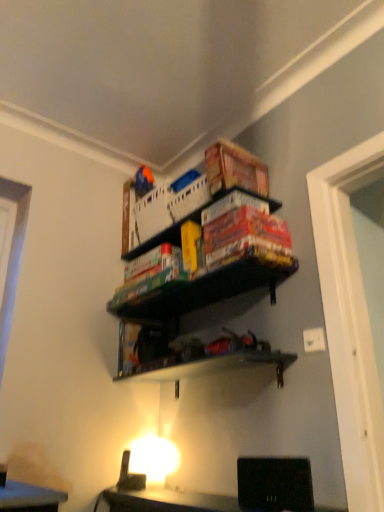
What do you see at coordinates (167, 207) in the screenshot? I see `white plastic crate at upper center` at bounding box center [167, 207].

Locate an element on the screen. white plastic crate at upper center is located at coordinates (167, 207).

What do you see at coordinates (205, 289) in the screenshot? I see `green matte board game at center` at bounding box center [205, 289].

The image size is (384, 512). Find the location of `green matte board game at center`. green matte board game at center is located at coordinates (205, 289).

Where is `white plastic crate at upper center`? Image resolution: width=384 pixels, height=512 pixels. white plastic crate at upper center is located at coordinates (167, 207).

Which object is positioned more to the left, white plastic crate at upper center or green matte board game at center?

white plastic crate at upper center is more to the left.

Is white plastic crate at upper center further to the viewer compared to green matte board game at center?

That is True.

Is point (165, 201) closer to camera compared to point (185, 288)?

No.

From the image's perspective, is white plastic crate at upper center on green matte board game at center?

Yes, from the image's perspective, white plastic crate at upper center is on top of green matte board game at center.

From a real-world perspective, between white plastic crate at upper center and green matte board game at center, who is vertically lower?

green matte board game at center.

Considering the sizes of objects white plastic crate at upper center and green matte board game at center in the image provided, who is wider, white plastic crate at upper center or green matte board game at center?

With larger width is green matte board game at center.

Considering the sizes of objects white plastic crate at upper center and green matte board game at center in the image provided, who is taller, white plastic crate at upper center or green matte board game at center?

white plastic crate at upper center is taller.

Between white plastic crate at upper center and green matte board game at center, which one has larger size?

Bigger between the two is white plastic crate at upper center.

Is green matte board game at center a part of white plastic crate at upper center?

That's incorrect, green matte board game at center is not inside white plastic crate at upper center.

Is white plastic crate at upper center placed right next to green matte board game at center?

white plastic crate at upper center is not next to green matte board game at center, and they're not touching.

Is white plastic crate at upper center oriented away from green matte board game at center?

No, white plastic crate at upper center is not facing the opposite direction of green matte board game at center.

How different are the orientations of white plastic crate at upper center and green matte board game at center in degrees?

There is a 4.12-degree angle between the facing directions of white plastic crate at upper center and green matte board game at center.

Locate an element on the screen. The image size is (384, 512). crate to the left of green matte board game at center is located at coordinates (167, 207).

Considering the relative positions of green matte board game at center and white plastic crate at upper center in the image provided, is green matte board game at center to the left or to the right of white plastic crate at upper center?

Clearly, green matte board game at center is on the right of white plastic crate at upper center in the image.

Which object is closer to the camera taking this photo, green matte board game at center or white plastic crate at upper center?

Positioned in front is green matte board game at center.

Considering the positions of point (146, 317) and point (153, 188), is point (146, 317) closer or farther from the camera than point (153, 188)?

Point (146, 317).

From the image's perspective, who appears lower, green matte board game at center or white plastic crate at upper center?

green matte board game at center appears lower in the image.

From a real-world perspective, is green matte board game at center positioned above or below white plastic crate at upper center?

From a real-world perspective, green matte board game at center is physically below white plastic crate at upper center.

Does green matte board game at center have a lesser width compared to white plastic crate at upper center?

No.

Considering the relative sizes of green matte board game at center and white plastic crate at upper center in the image provided, is green matte board game at center taller than white plastic crate at upper center?

No.

Who is bigger, green matte board game at center or white plastic crate at upper center?

white plastic crate at upper center is bigger.

Is white plastic crate at upper center a part of green matte board game at center?

No, green matte board game at center does not contain white plastic crate at upper center.

Is green matte board game at center with white plastic crate at upper center?

No, green matte board game at center is not touching white plastic crate at upper center.

Is green matte board game at center facing towards white plastic crate at upper center?

No, green matte board game at center is not aimed at white plastic crate at upper center.

I want to click on crate above the green matte board game at center (from the image's perspective), so click(167, 207).

The width and height of the screenshot is (384, 512). I want to click on crate that is behind the green matte board game at center, so click(x=167, y=207).

Identify the location of shelf located on the right of white plastic crate at upper center. (205, 289).